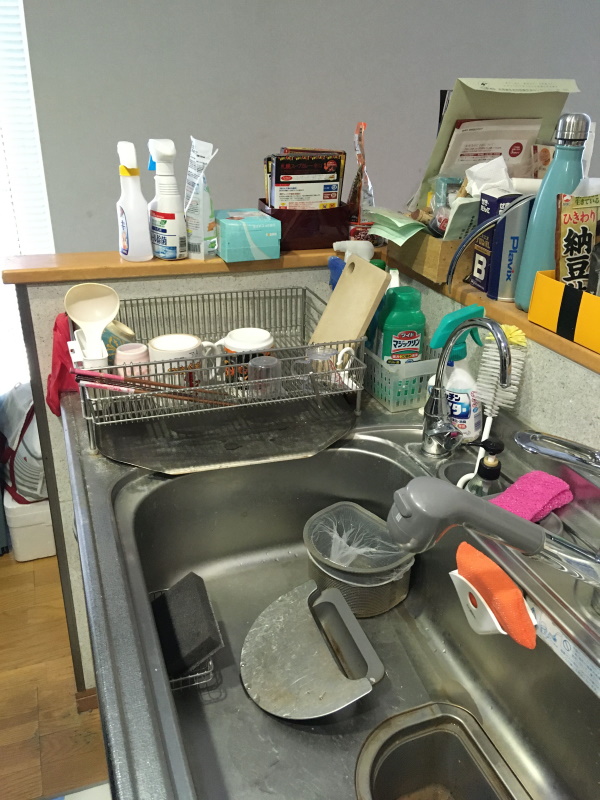
Image resolution: width=600 pixels, height=800 pixels. Identify the location of tap. (429, 506), (437, 408).